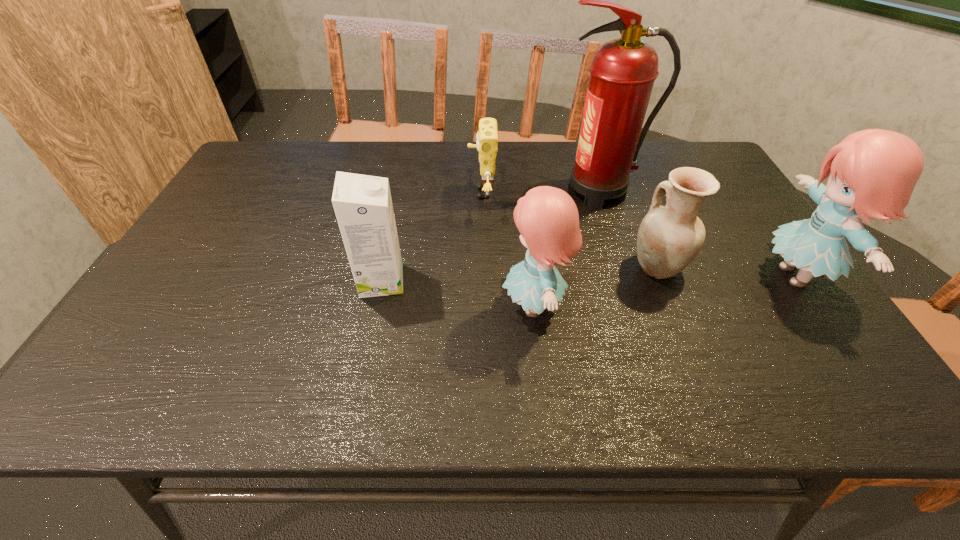
Identify the location of free space for a new doll on the left. This screenshot has width=960, height=540. (236, 341).